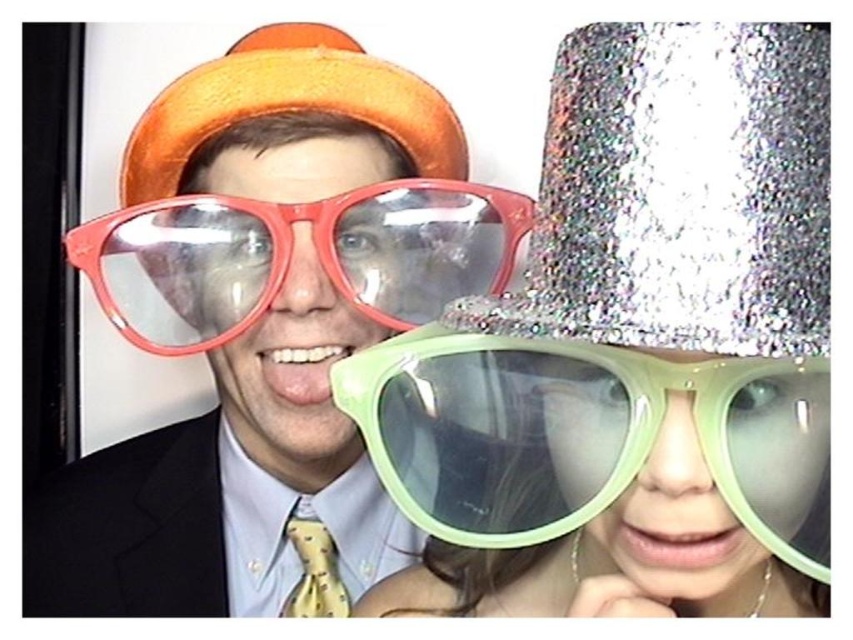
Who is lower down, glittery silver hat at upper right or orange felt hat at upper center?

glittery silver hat at upper right is below.

Can you confirm if glittery silver hat at upper right is positioned to the right of orange felt hat at upper center?

Indeed, glittery silver hat at upper right is positioned on the right side of orange felt hat at upper center.

Measure the distance between point (x=608, y=113) and camera.

A distance of 16.66 inches exists between point (x=608, y=113) and camera.

What are the coordinates of `glittery silver hat at upper right` in the screenshot? It's located at (682, 193).

Can you confirm if orange felt hat at upper center is positioned below yellow dotted tie at center?

Actually, orange felt hat at upper center is above yellow dotted tie at center.

Where is `orange felt hat at upper center`? orange felt hat at upper center is located at coordinates (288, 104).

Does green translucent sunglasses at center have a lesser height compared to orange felt hat at upper center?

Yes, green translucent sunglasses at center is shorter than orange felt hat at upper center.

Between green translucent sunglasses at center and orange felt hat at upper center, which one is positioned lower?

green translucent sunglasses at center is below.

Is point (485, 372) less distant than point (347, 97)?

Yes, it is in front of point (347, 97).

Locate an element on the screen. green translucent sunglasses at center is located at coordinates (583, 435).